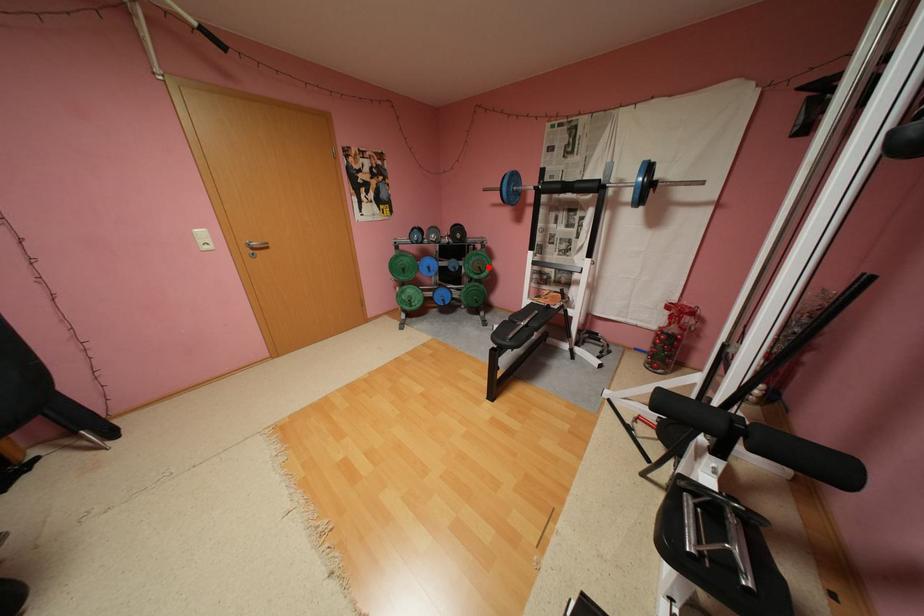
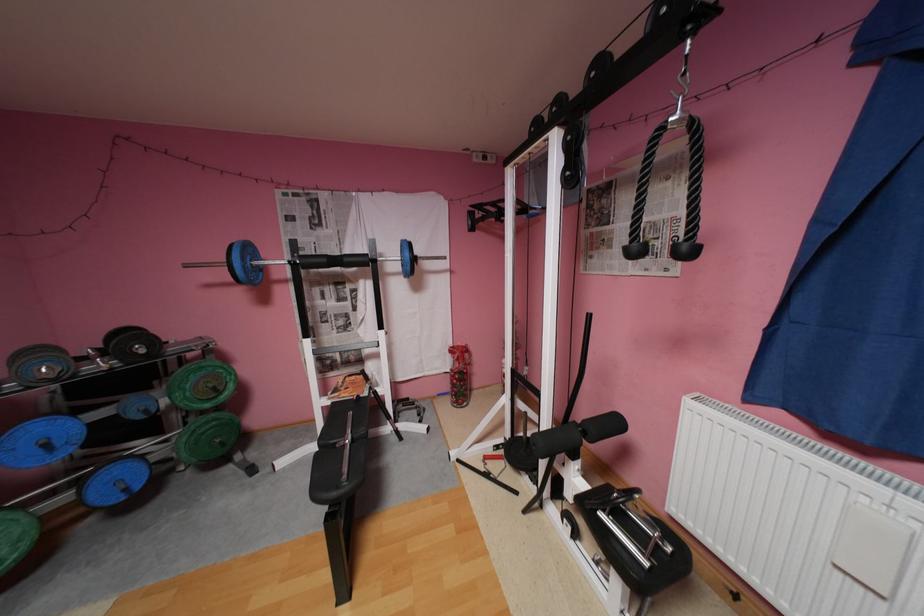
Question: I am providing you with two images of the same scene from different viewpoints. In image1, a red point is highlighted. Considering the same 3D point in image2, which of the following is correct?

Choices:
 (A) It is closer
 (B) It is farther

Answer: (B)